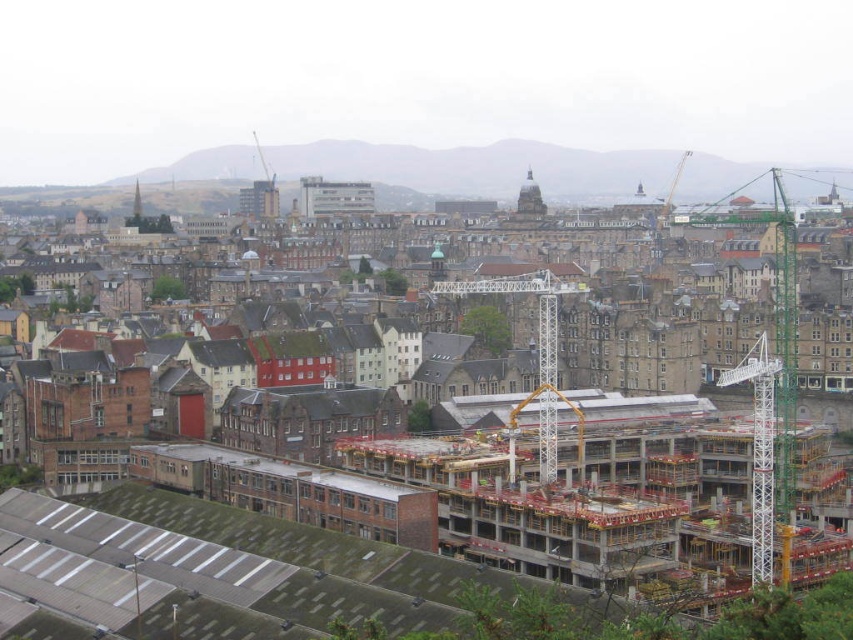
You are a city planner reviewing the construction progress of the concrete construction site at center. You notice a white metallic crane at center in the image. Based on their positions, can you determine if the crane is currently working on the construction site?

The concrete construction site at center is positioned under the white metallic crane at center, which indicates that the crane is likely working on the construction site.

You are a city planner reviewing this image. You need to determine which object is nearer to the observer between the concrete construction site at center and the white metallic crane at center. Which one is closer?

The concrete construction site at center is closer to the viewer than the white metallic crane at center.

You are a city planner reviewing this image. Which object, the concrete construction site at center or the white metallic crane at right, has a greater height?

The concrete construction site at center is much taller than the white metallic crane at right.